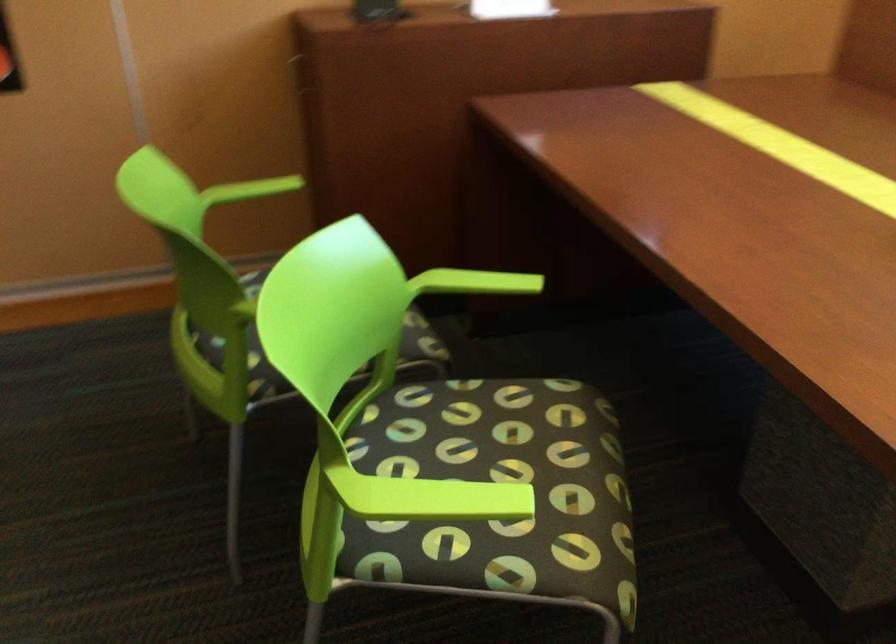
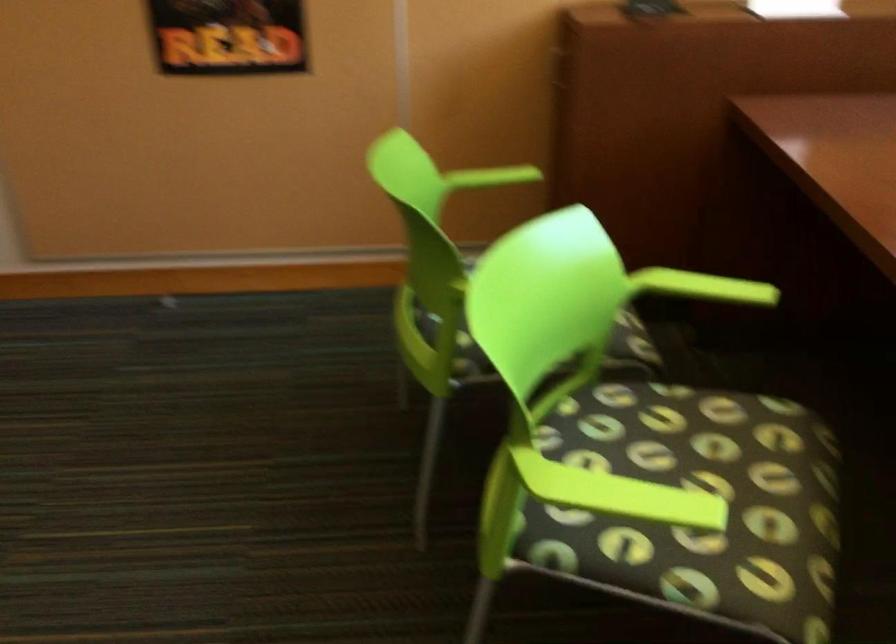
Where in the second image is the point corresponding to the point at 479,281 from the first image?

(702, 287)